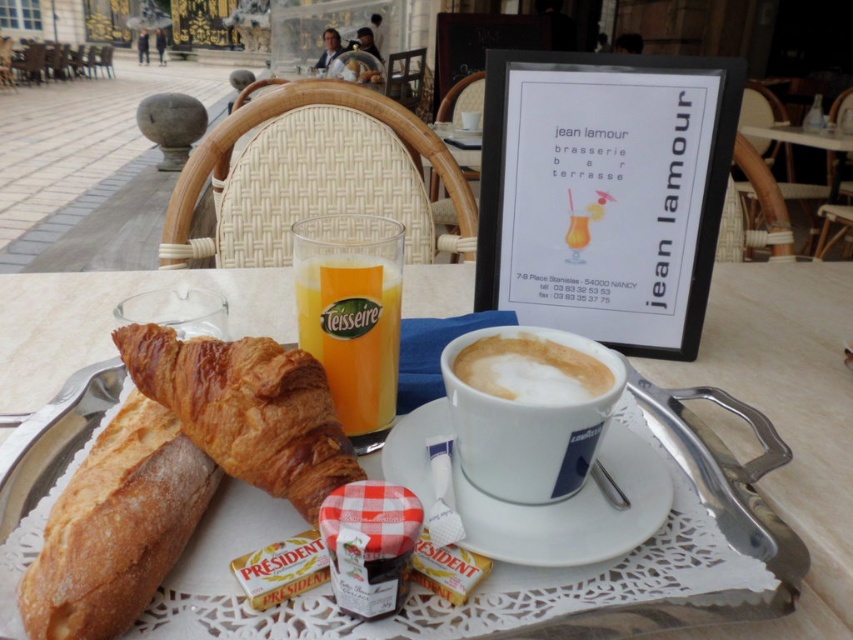
You are a photographer standing at the entrance of the Jean Lamour brasserie bar terrasse. You want to take a closeup shot of the white porcelain tray at center. According to the scene description, what is the minimum distance you need to move forward to ensure the tray fills the frame?

The white porcelain tray at center is 11.28 inches away from the camera. To ensure the tray fills the frame, you need to move forward until the distance between you and the tray is at least 11.28 inches.

Based on the photo, you are a customer at the Jean Lamour brasserie bar terrasse. You see an orangematte glass at center and a white frothy coffee cup at center on your breakfast tray. Which item is positioned higher on the tray?

The orangematte glass at center is located above the white frothy coffee cup at center, so the orangematte glass at center is positioned higher on the tray.

What is the object located at the coordinates point (352, 333) in the image?

The object at point (352, 333) is the orangematte glass at center.